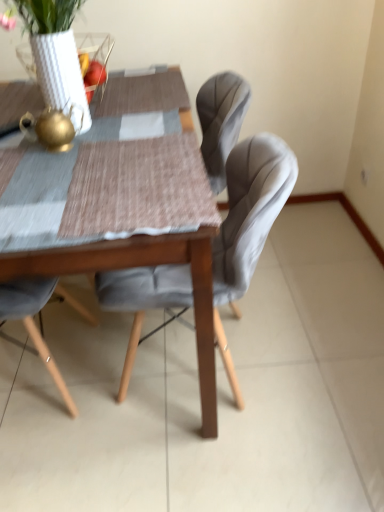
Locate an element on the screen. free point above velvet grey chair at center (from a real-world perspective) is located at coordinates (145, 164).